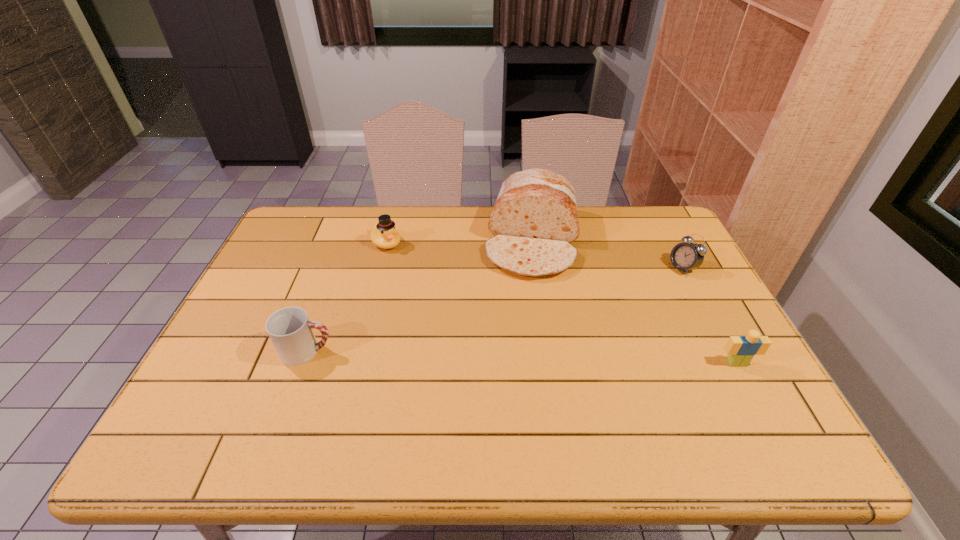
Locate an element on the screen. The image size is (960, 540). alarm clock at the right edge is located at coordinates (686, 256).

What are the coordinates of `vacant space at the far edge` in the screenshot? It's located at (444, 219).

In the image, there is a desktop. Identify the location of vacant region at the near edge. The width and height of the screenshot is (960, 540). (345, 399).

In the image, there is a desktop. In order to click on vacant region at the left edge in this screenshot , I will do `click(262, 285)`.

Locate an element on the screen. vacant space at the right edge is located at coordinates (729, 368).

In the image, there is a desktop. In order to click on vacant space at the far left corner in this screenshot , I will do `click(338, 214)`.

Locate an element on the screen. The width and height of the screenshot is (960, 540). free spot at the near left corner of the desktop is located at coordinates (214, 407).

Identify the location of free point at the far right corner. The image size is (960, 540). (647, 210).

You are a GUI agent. You are given a task and a screenshot of the screen. Output one action in this format:
    pyautogui.click(x=<x>, y=<y>)
    Task: Click on the vacant space that is in between the Lego and the bread
    The height and width of the screenshot is (540, 960).
    Given the screenshot: What is the action you would take?
    pyautogui.click(x=635, y=302)

Locate an element on the screen. The width and height of the screenshot is (960, 540). unoccupied position between the Lego and the cup is located at coordinates (522, 357).